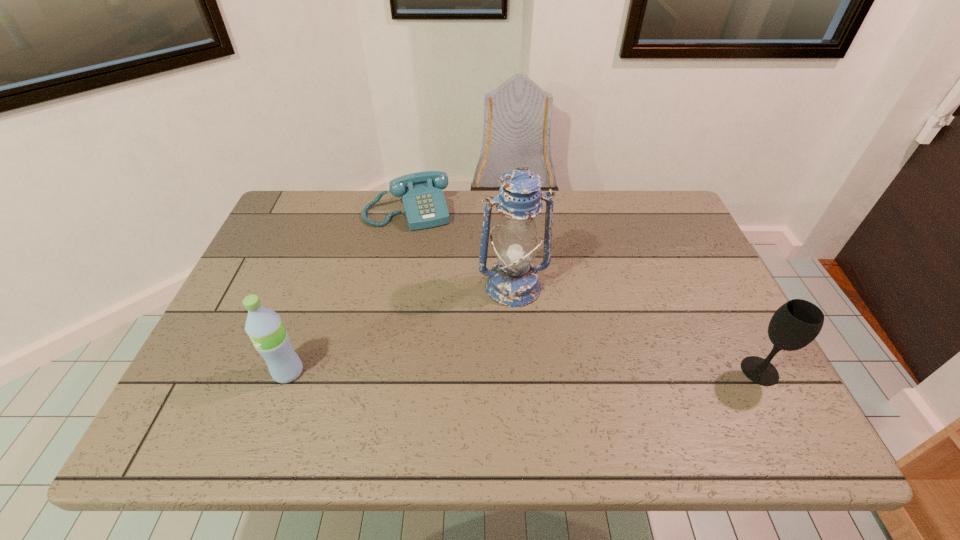
Where is `free space on the desktop that is between the third shortest object and the rightmost object and is positioned on the dial of the farthest object`? This screenshot has height=540, width=960. free space on the desktop that is between the third shortest object and the rightmost object and is positioned on the dial of the farthest object is located at coordinates (457, 372).

Find the location of `vacant space on the desktop that is between the water bottle and the wineglass and is positioned on the front-facing side of the tallest object`. vacant space on the desktop that is between the water bottle and the wineglass and is positioned on the front-facing side of the tallest object is located at coordinates (536, 372).